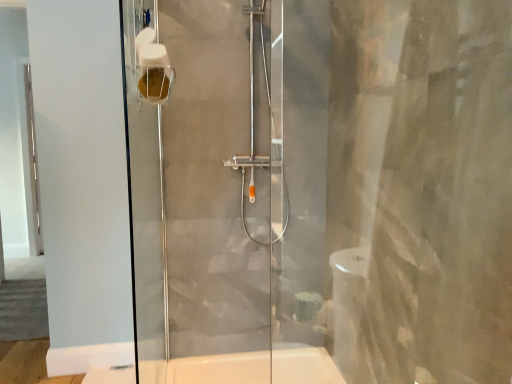
Question: Is white matte toilet paper at upper left facing towards satin chrome shower at center?

Choices:
 (A) yes
 (B) no

Answer: (B)

Question: Can satin chrome shower at center be found inside white matte toilet paper at upper left?

Choices:
 (A) yes
 (B) no

Answer: (B)

Question: Can you confirm if white matte toilet paper at upper left is wider than satin chrome shower at center?

Choices:
 (A) yes
 (B) no

Answer: (B)

Question: Would you say white matte toilet paper at upper left is outside satin chrome shower at center?

Choices:
 (A) no
 (B) yes

Answer: (B)

Question: Is white matte toilet paper at upper left not near satin chrome shower at center?

Choices:
 (A) no
 (B) yes

Answer: (B)

Question: Can you confirm if white matte toilet paper at upper left is positioned to the left of satin chrome shower at center?

Choices:
 (A) no
 (B) yes

Answer: (B)

Question: Is satin chrome shower at center facing away from white matte toilet paper at upper left?

Choices:
 (A) yes
 (B) no

Answer: (B)

Question: Is satin chrome shower at center outside of white matte toilet paper at upper left?

Choices:
 (A) no
 (B) yes

Answer: (B)

Question: Can you confirm if satin chrome shower at center is positioned to the right of white matte toilet paper at upper left?

Choices:
 (A) no
 (B) yes

Answer: (B)

Question: Can you confirm if satin chrome shower at center is wider than white matte toilet paper at upper left?

Choices:
 (A) no
 (B) yes

Answer: (B)

Question: Would you say white matte toilet paper at upper left is part of satin chrome shower at center's contents?

Choices:
 (A) yes
 (B) no

Answer: (B)

Question: From the image's perspective, does satin chrome shower at center appear higher than white matte toilet paper at upper left?

Choices:
 (A) yes
 (B) no

Answer: (B)

Question: From the image's perspective, is satin chrome shower at center above or below white matte toilet paper at upper left?

Choices:
 (A) below
 (B) above

Answer: (A)